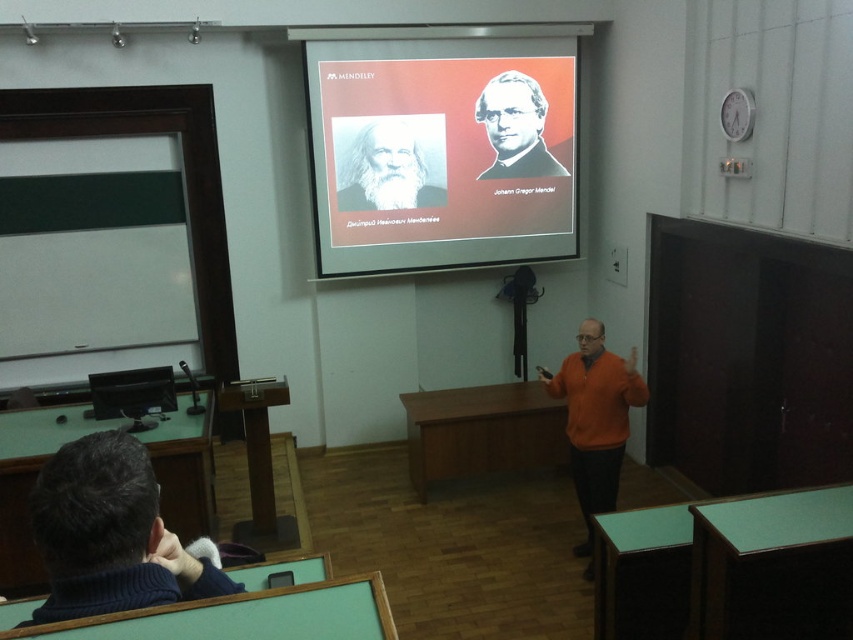
Who is lower down, orange sweater at center or smooth black portrait at upper right?

Positioned lower is orange sweater at center.

Between point (590, 449) and point (491, 125), which one is positioned behind?

Point (491, 125)

Where is `orange sweater at center`? orange sweater at center is located at coordinates (595, 419).

Where is `orange sweater at center`? The height and width of the screenshot is (640, 853). orange sweater at center is located at coordinates (595, 419).

Does dark blue sweater at lower left lie behind orange sweater at center?

No, it is in front of orange sweater at center.

What do you see at coordinates (109, 534) in the screenshot?
I see `dark blue sweater at lower left` at bounding box center [109, 534].

Find the location of a particular element. dark blue sweater at lower left is located at coordinates (109, 534).

Can you confirm if dark blue sweater at lower left is positioned above smooth black portrait at upper right?

No.

Which is in front, point (62, 512) or point (520, 150)?

Point (62, 512)

Image resolution: width=853 pixels, height=640 pixels. I want to click on dark blue sweater at lower left, so click(x=109, y=534).

Where is `dark blue sweater at lower left`? The image size is (853, 640). dark blue sweater at lower left is located at coordinates [109, 534].